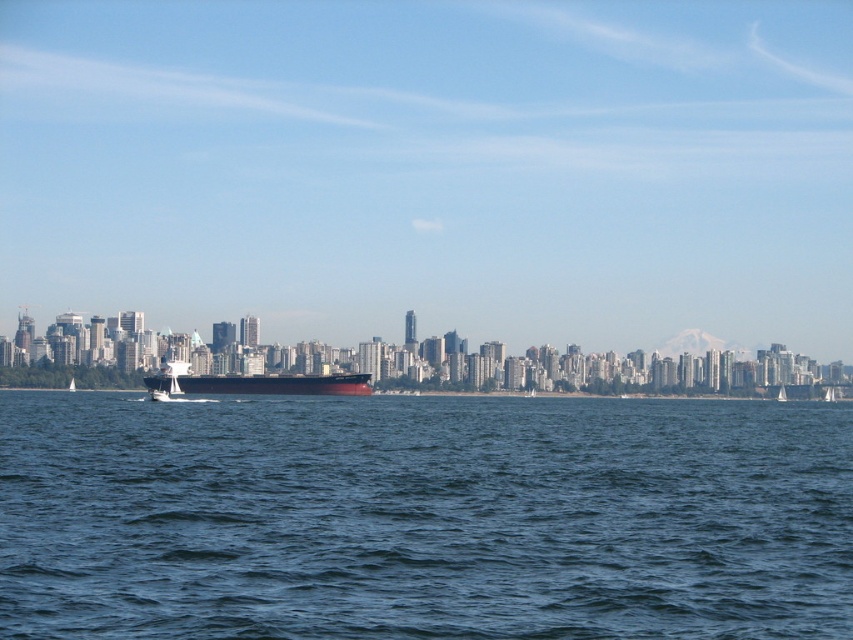
You are a photographer planning to capture the city skyline reflected in the blue water at center. However, the smooth black ship at center might block the reflection. Based on their heights, will the ship obscure the reflection of the skyline in the water?

The blue water at center has a greater height compared to the smooth black ship at center. Since the water is higher, the ship would not block the reflection of the skyline in the water.

You are a photographer standing on a pier and want to capture both the blue water at center and the smooth black ship at center in your shot. Based on their positions, which one will appear larger in the photo?

The blue water at center will appear larger in the photo because it is closer to the viewer than the smooth black ship at center.

You are standing on the dock and see two points in the water. The first point is at coordinate point(264,570) and the second is at point(206,380). Which point is closer to you?

Point(264,570) is closer to the viewer than point(206,380).